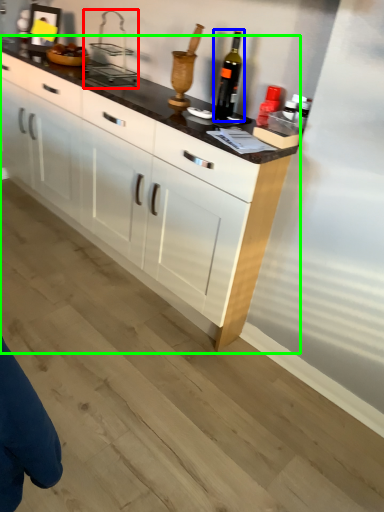
Question: Based on their relative distances, which object is nearer to appliance (highlighted by a red box)? Choose from wine bottle (highlighted by a blue box) and cabinetry (highlighted by a green box).

Choices:
 (A) wine bottle
 (B) cabinetry

Answer: (B)